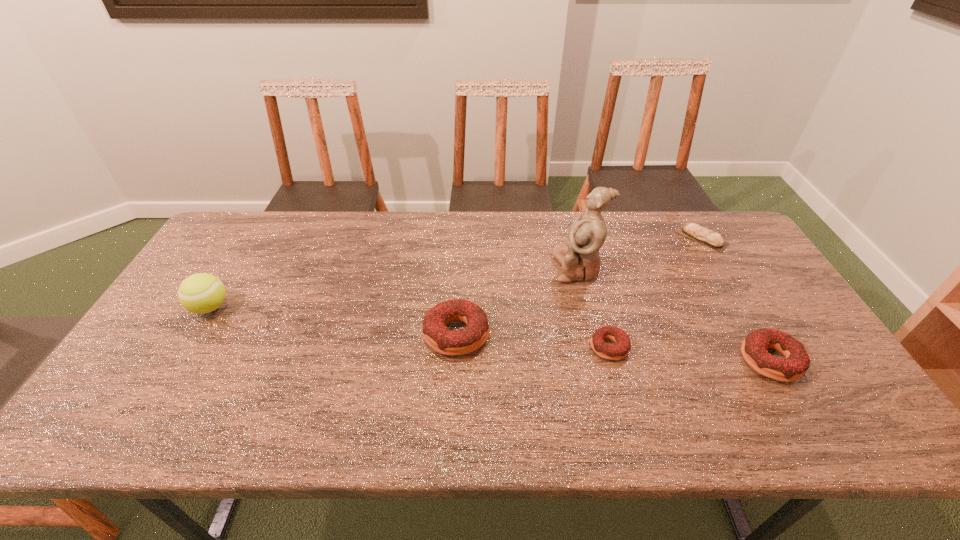
I want to click on free space located 0.170m on the back of the second tallest doughnut, so 731,292.

Where is `free space located 0.080m on the front of the pita bread`? The height and width of the screenshot is (540, 960). free space located 0.080m on the front of the pita bread is located at coordinates (720, 270).

Locate an element on the screen. The width and height of the screenshot is (960, 540). free spot located on the front-facing side of the figurine is located at coordinates (431, 268).

You are a GUI agent. You are given a task and a screenshot of the screen. Output one action in this format:
    pyautogui.click(x=<x>, y=<y>)
    Task: Click on the vacant region located on the front-facing side of the figurine
    Image resolution: width=960 pixels, height=540 pixels.
    Given the screenshot: What is the action you would take?
    pyautogui.click(x=441, y=268)

Image resolution: width=960 pixels, height=540 pixels. Find the location of `blank space located 0.310m on the front-facing side of the figurine`. blank space located 0.310m on the front-facing side of the figurine is located at coordinates (453, 268).

You are a GUI agent. You are given a task and a screenshot of the screen. Output one action in this format:
    pyautogui.click(x=<x>, y=<y>)
    Task: Click on the free space located 0.230m on the back of the leftmost object
    This screenshot has width=960, height=540.
    Given the screenshot: What is the action you would take?
    pyautogui.click(x=250, y=244)

This screenshot has width=960, height=540. I want to click on pita bread located at the far edge, so click(703, 235).

The width and height of the screenshot is (960, 540). What are the coordinates of `figurine at the far edge` in the screenshot? It's located at (579, 258).

The image size is (960, 540). I want to click on object that is at the near edge, so click(795, 364).

Find the location of a particular element. The image size is (960, 540). object at the left edge is located at coordinates (201, 293).